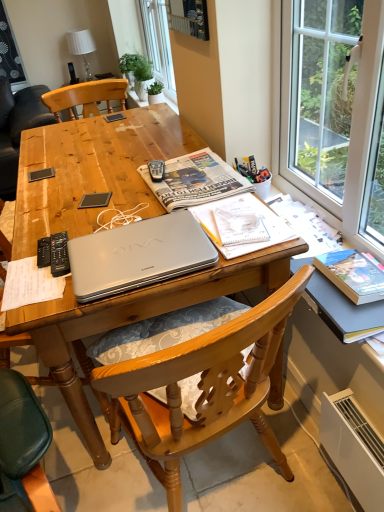
Find the location of a particular element. The height and width of the screenshot is (512, 384). spots to the right of silver metallic laptop at center is located at coordinates (234, 225).